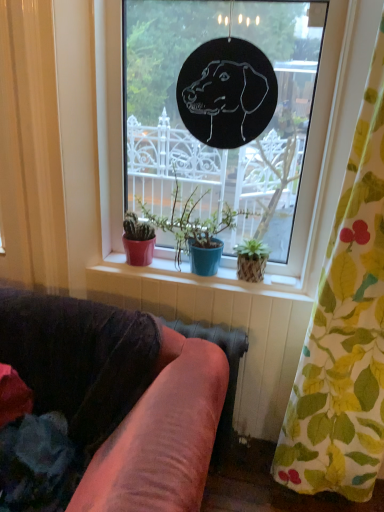
At what (x,y) coordinates should I click in order to perform the action: click on black paper dog at center. Please return your answer as a coordinate pair (x, y). The image size is (384, 512). Looking at the image, I should click on (317, 149).

Measure the distance between point (195, 245) and camera.

Point (195, 245) and camera are 1.70 meters apart.

This screenshot has width=384, height=512. I want to click on floral fabric curtain at right, so click(x=345, y=332).

Could matte red pot at center be considered to be inside matte ceramic pots at center?

No, matte red pot at center is not surrounded by matte ceramic pots at center.

Does matte ceramic pots at center touch matte red pot at center?

No, matte ceramic pots at center is not in contact with matte red pot at center.

Which object is wider, matte ceramic pots at center or matte red pot at center?

matte red pot at center.

Is there a large distance between velvet pink couch at lower left and floral fabric curtain at right?

Actually, velvet pink couch at lower left and floral fabric curtain at right are a little close together.

Is velvet pink couch at lower left oriented towards floral fabric curtain at right?

No, velvet pink couch at lower left does not turn towards floral fabric curtain at right.

From the image's perspective, is velvet pink couch at lower left above or below floral fabric curtain at right?

velvet pink couch at lower left is below floral fabric curtain at right.

From the picture: Can you confirm if velvet pink couch at lower left is shorter than floral fabric curtain at right?

Yes, velvet pink couch at lower left is shorter than floral fabric curtain at right.

From a real-world perspective, is velvet pink couch at lower left positioned over black paper dog at center based on gravity?

No, from a real-world perspective, velvet pink couch at lower left is not on top of black paper dog at center.

Would you say velvet pink couch at lower left is inside or outside black paper dog at center?

velvet pink couch at lower left exists outside the volume of black paper dog at center.

Does velvet pink couch at lower left have a smaller size compared to black paper dog at center?

No, velvet pink couch at lower left is not smaller than black paper dog at center.

From the image's perspective, which object appears higher, velvet pink couch at lower left or black paper dog at center?

From the image's view, black paper dog at center is above.

Is the position of matte ceramic pots at center more distant than that of black paper dog at center?

Yes, matte ceramic pots at center is further from the camera.

Which point is more distant from viewer, (186, 298) or (347, 136)?

The point (186, 298) is behind.

Would you say matte ceramic pots at center contains black paper dog at center?

No, matte ceramic pots at center does not contain black paper dog at center.

Considering the relative sizes of matte ceramic pots at center and black paper dog at center in the image provided, is matte ceramic pots at center thinner than black paper dog at center?

Indeed, matte ceramic pots at center has a lesser width compared to black paper dog at center.

Is black paper dog at center thinner than matte ceramic pots at center?

No.

Is matte ceramic pots at center inside black paper dog at center?

That's correct, matte ceramic pots at center is inside black paper dog at center.

Can you tell me how much black paper dog at center and matte ceramic pots at center differ in facing direction?

black paper dog at center and matte ceramic pots at center are facing 0.00062 degrees away from each other.

Between point (312, 144) and point (266, 280), which one is positioned in front?

Point (312, 144)

Would you say matte red pot at center is inside or outside velvet pink couch at lower left?

matte red pot at center is not inside velvet pink couch at lower left, it's outside.

Can you confirm if matte red pot at center is wider than velvet pink couch at lower left?

Incorrect, the width of matte red pot at center does not surpass that of velvet pink couch at lower left.

Which object is further away from the camera, matte red pot at center or velvet pink couch at lower left?

matte red pot at center is further from the camera.

From the image's perspective, is matte red pot at center on top of velvet pink couch at lower left?

Correct, matte red pot at center appears higher than velvet pink couch at lower left in the image.

Would you say matte red pot at center is a long distance from matte ceramic pots at center?

No, matte red pot at center is in close proximity to matte ceramic pots at center.

Considering the sizes of objects matte red pot at center and matte ceramic pots at center in the image provided, who is thinner, matte red pot at center or matte ceramic pots at center?

matte ceramic pots at center.

The width and height of the screenshot is (384, 512). Find the location of `window sill that is under the matte red pot at center (from a real-world perspective)`. window sill that is under the matte red pot at center (from a real-world perspective) is located at coordinates (179, 280).

The height and width of the screenshot is (512, 384). I want to click on houseplant located on the left of matte ceramic pots at center, so pos(194,229).

I want to click on studio couch in front of the floral fabric curtain at right, so click(120, 396).

From the image, which object appears to be nearer to matte red pot at center, velvet pink couch at lower left or floral fabric curtain at right?

Among the two, velvet pink couch at lower left is located nearer to matte red pot at center.

From the image, which object appears to be nearer to matte red pot at center, velvet pink couch at lower left or matte ceramic pots at center?

matte ceramic pots at center is positioned closer to the anchor matte red pot at center.

When comparing their distances from floral fabric curtain at right, does velvet pink couch at lower left or black paper dog at center seem further?

velvet pink couch at lower left.

Estimate the real-world distances between objects in this image. Which object is further from floral fabric curtain at right, black paper dog at center or matte red pot at center?

Among the two, matte red pot at center is located further to floral fabric curtain at right.

Estimate the real-world distances between objects in this image. Which object is closer to matte ceramic pots at center, black paper dog at center or floral fabric curtain at right?

black paper dog at center.

Considering their positions, is black paper dog at center positioned closer to velvet pink couch at lower left than matte ceramic pots at center?

The object closer to velvet pink couch at lower left is matte ceramic pots at center.

Which object lies further to the anchor point black paper dog at center, matte ceramic pots at center or matte red pot at center?

matte ceramic pots at center.

When comparing their distances from matte ceramic pots at center, does matte red pot at center or black paper dog at center seem further?

black paper dog at center.

The image size is (384, 512). I want to click on window between floral fabric curtain at right and matte red pot at center in the front-back direction, so [x=317, y=149].

Find the location of a particular element. houseplant situated between velvet pink couch at lower left and floral fabric curtain at right from left to right is located at coordinates (194, 229).

Locate an element on the screen. Image resolution: width=384 pixels, height=512 pixels. window sill situated between velvet pink couch at lower left and floral fabric curtain at right from left to right is located at coordinates (179, 280).

Where is `houseplant between black paper dog at center and velvet pink couch at lower left from top to bottom`? houseplant between black paper dog at center and velvet pink couch at lower left from top to bottom is located at coordinates (194, 229).